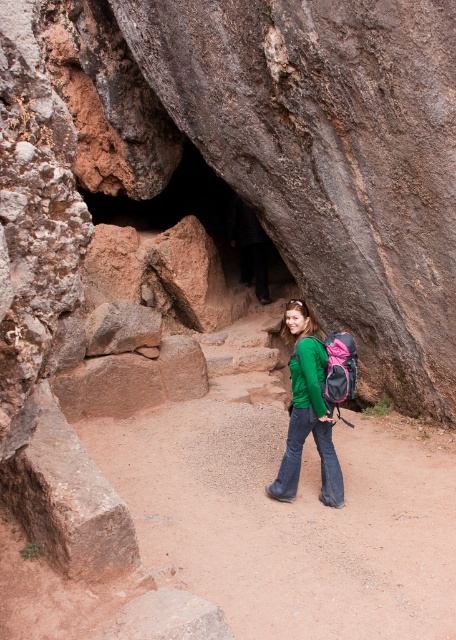
Describe the element at coordinates (306, 410) in the screenshot. I see `green matte shirt at center` at that location.

What do you see at coordinates (306, 410) in the screenshot? I see `green matte shirt at center` at bounding box center [306, 410].

Where is `green matte shirt at center`? The image size is (456, 640). green matte shirt at center is located at coordinates (306, 410).